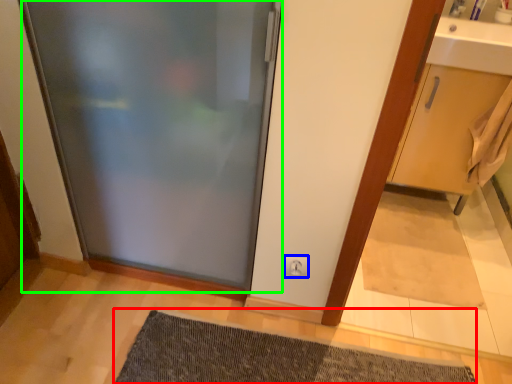
Question: Estimate the real-world distances between objects in this image. Which object is farther from bath mat (highlighted by a red box), electric outlet (highlighted by a blue box) or door (highlighted by a green box)?

Choices:
 (A) electric outlet
 (B) door

Answer: (B)